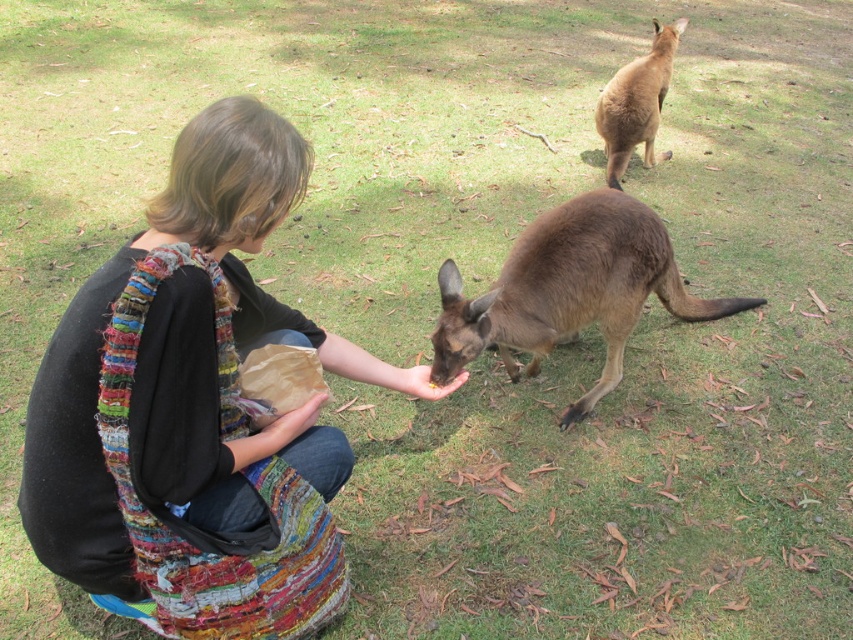
You are a wildlife photographer aiming to capture a photo of both brown furry kangaroo at center and brown furry kangaroo at upper right. Since you want them both in the frame, which direction should you move your camera to include both kangaroos?

To include both the brown furry kangaroo at center and the brown furry kangaroo at upper right in the frame, you should pan your camera to the left, as the brown furry kangaroo at center is positioned to the left of the brown furry kangaroo at upper right.